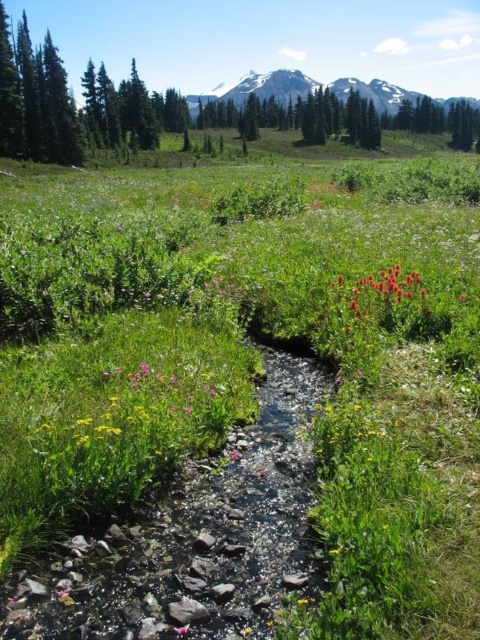
Question: Does snowy granite mountain at upper center have a lesser width compared to pink matte flower at center?

Choices:
 (A) yes
 (B) no

Answer: (B)

Question: Is snowy granite mountain at upper center behind vivid crimson petals at center?

Choices:
 (A) yes
 (B) no

Answer: (A)

Question: Among these points, which one is farthest from the camera?

Choices:
 (A) (371, 84)
 (B) (391, 269)

Answer: (A)

Question: Which point is closer to the camera?

Choices:
 (A) pink matte flower at center
 (B) snowy granite mountain at upper center
 (C) vivid crimson petals at center

Answer: (A)

Question: Does vivid crimson petals at center come in front of pink matte flower at center?

Choices:
 (A) yes
 (B) no

Answer: (B)

Question: Which object is positioned closest to the vivid crimson petals at center?

Choices:
 (A) snowy granite mountain at upper center
 (B) pink matte flower at center

Answer: (B)